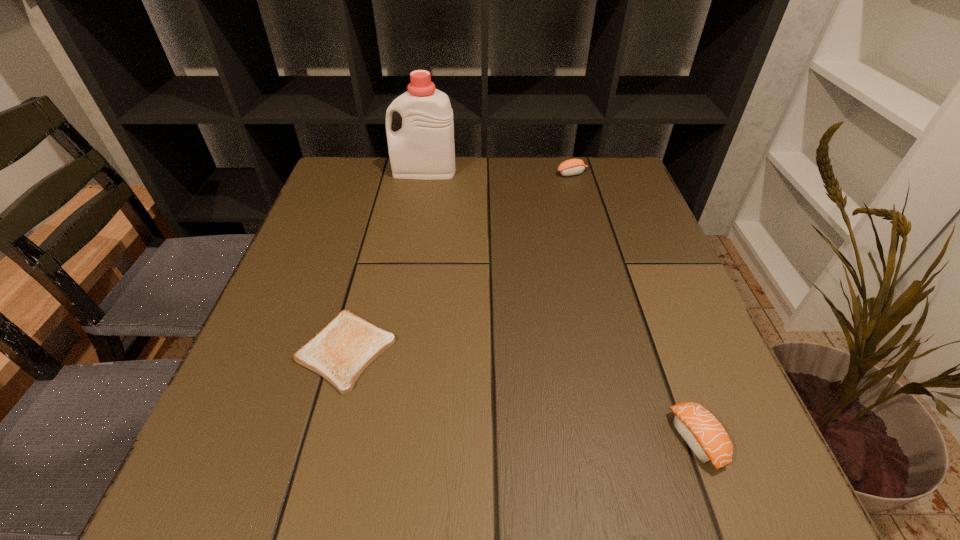
This screenshot has height=540, width=960. I want to click on empty space that is in between the nearer sushi and the tallest object, so click(x=561, y=306).

Identify the location of object that can be found as the third closest to the toast. (570, 167).

Identify the location of the closest object to the nearer sushi. This screenshot has width=960, height=540. (342, 349).

This screenshot has width=960, height=540. I want to click on vacant region that satisfies the following two spatial constraints: 1. on the handle side of the tallest object; 2. on the back side of the nearer sushi, so click(377, 440).

The image size is (960, 540). Find the location of `free space that satisfies the following two spatial constraints: 1. on the handle side of the tallest object; 2. on the back side of the nearer sushi`. free space that satisfies the following two spatial constraints: 1. on the handle side of the tallest object; 2. on the back side of the nearer sushi is located at coordinates (377, 440).

This screenshot has width=960, height=540. I want to click on vacant area in the image that satisfies the following two spatial constraints: 1. on the handle side of the farther sushi; 2. on the right side of the detergent, so click(x=423, y=173).

The image size is (960, 540). In order to click on vacant region that satisfies the following two spatial constraints: 1. on the handle side of the tallest object; 2. on the right side of the nearest object in this screenshot , I will do `click(377, 440)`.

At what (x,y) coordinates should I click in order to perform the action: click on vacant space that satisfies the following two spatial constraints: 1. on the back side of the farther sushi; 2. on the handle side of the detergent. Please return your answer as a coordinate pair (x, y). Looking at the image, I should click on (571, 171).

Find the location of a particular element. The height and width of the screenshot is (540, 960). vacant space that satisfies the following two spatial constraints: 1. on the back side of the farther sushi; 2. on the handle side of the detergent is located at coordinates (571, 171).

At what (x,y) coordinates should I click in order to perform the action: click on free location that satisfies the following two spatial constraints: 1. on the handle side of the tallest object; 2. on the right side of the nearer sushi. Please return your answer as a coordinate pair (x, y). Looking at the image, I should click on (377, 440).